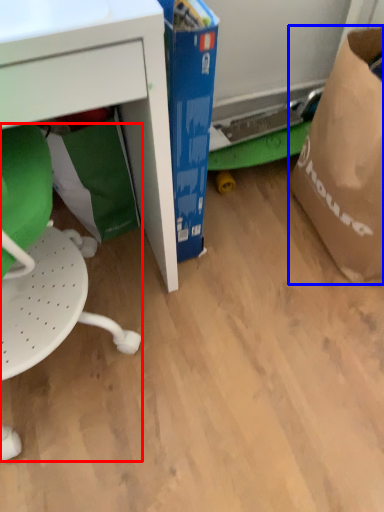
Question: Among these objects, which one is farthest to the camera, swivel chair (highlighted by a red box) or grocery bag (highlighted by a blue box)?

Choices:
 (A) swivel chair
 (B) grocery bag

Answer: (B)